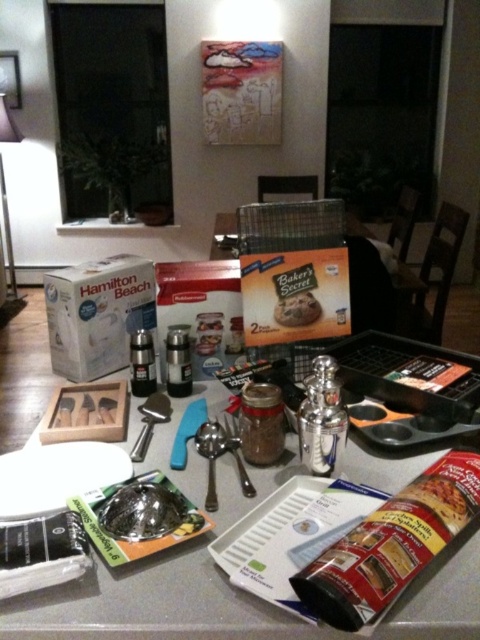
Question: Does white cardboard hamilton beach at center have a lesser width compared to matte cardboard box at center?

Choices:
 (A) no
 (B) yes

Answer: (A)

Question: Among these objects, which one is farthest from the camera?

Choices:
 (A) metallic silver tray at center
 (B) metallic silver spatula at center
 (C) matte cardboard box at center
 (D) metallic spoon at center

Answer: (A)

Question: Observing the image, what is the correct spatial positioning of matte cardboard box at center in reference to baked chocolate chip cookie at center?

Choices:
 (A) left
 (B) right

Answer: (A)

Question: Considering the real-world distances, which object is closest to the white cardboard hamilton beach at center?

Choices:
 (A) metallic silver spatula at center
 (B) metallic spoon at center
 (C) matte cardboard box at center
 (D) metallic silver tray at center

Answer: (C)

Question: Does white cardboard hamilton beach at center appear over metallic silver spatula at center?

Choices:
 (A) no
 (B) yes

Answer: (B)

Question: Which of the following is the closest to the observer?

Choices:
 (A) metallic silver spatula at center
 (B) metallic silver tray at center
 (C) matte cardboard box at center
 (D) baked chocolate chip cookie at center

Answer: (A)